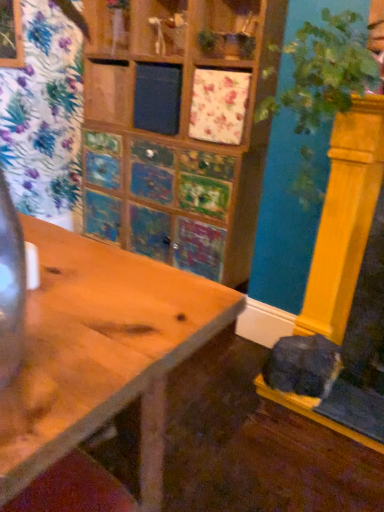
Question: Can you confirm if soft gray fur cat at lower right is positioned to the right of wooden table at center?

Choices:
 (A) no
 (B) yes

Answer: (B)

Question: Is soft gray fur cat at lower right in front of wooden table at center?

Choices:
 (A) no
 (B) yes

Answer: (A)

Question: Can you confirm if soft gray fur cat at lower right is thinner than wooden table at center?

Choices:
 (A) yes
 (B) no

Answer: (A)

Question: Can you confirm if soft gray fur cat at lower right is smaller than wooden table at center?

Choices:
 (A) no
 (B) yes

Answer: (B)

Question: Is soft gray fur cat at lower right far away from wooden table at center?

Choices:
 (A) no
 (B) yes

Answer: (B)

Question: In the image, is wooden table at center on the left side or the right side of green leafy plant at right?

Choices:
 (A) left
 (B) right

Answer: (A)

Question: Considering their positions, is wooden table at center located in front of or behind green leafy plant at right?

Choices:
 (A) front
 (B) behind

Answer: (A)

Question: From the image's perspective, relative to green leafy plant at right, is wooden table at center above or below?

Choices:
 (A) above
 (B) below

Answer: (B)

Question: Is point (134, 361) closer or farther from the camera than point (306, 62)?

Choices:
 (A) closer
 (B) farther

Answer: (A)

Question: In the image, is soft gray fur cat at lower right positioned in front of or behind wooden table at center?

Choices:
 (A) front
 (B) behind

Answer: (B)

Question: Do you think soft gray fur cat at lower right is within wooden table at center, or outside of it?

Choices:
 (A) inside
 (B) outside

Answer: (B)

Question: In terms of height, does soft gray fur cat at lower right look taller or shorter compared to wooden table at center?

Choices:
 (A) short
 (B) tall

Answer: (A)

Question: Looking at the image, does soft gray fur cat at lower right seem bigger or smaller compared to wooden table at center?

Choices:
 (A) big
 (B) small

Answer: (B)

Question: Choose the correct answer: Is green leafy plant at right inside wooden table at center or outside it?

Choices:
 (A) outside
 (B) inside

Answer: (A)

Question: In terms of width, does green leafy plant at right look wider or thinner when compared to wooden table at center?

Choices:
 (A) wide
 (B) thin

Answer: (A)